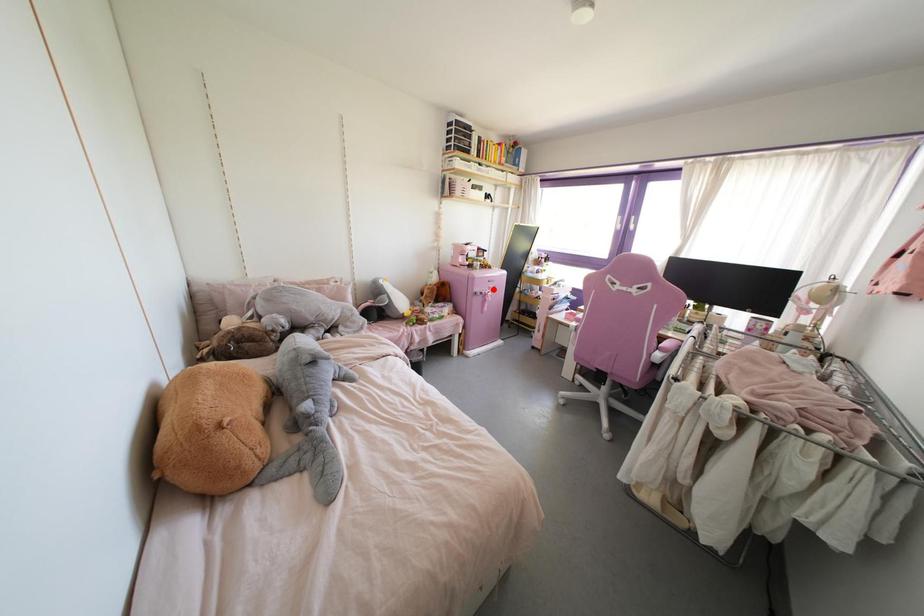
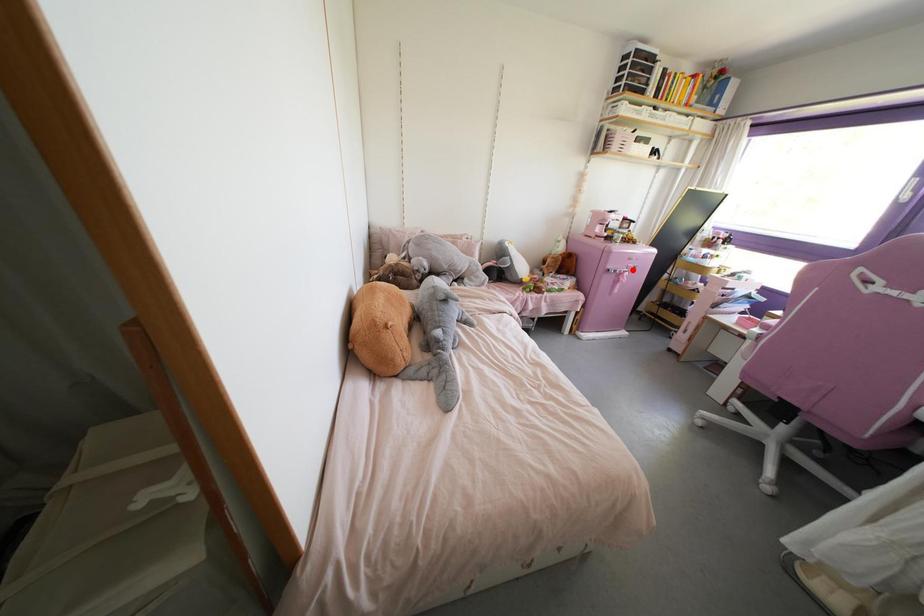
I am providing you with two images of the same scene from different viewpoints. A red point is marked on the first image and another point is marked on the second image. Is the red point in image1 aligned with the point shown in image2?

Yes